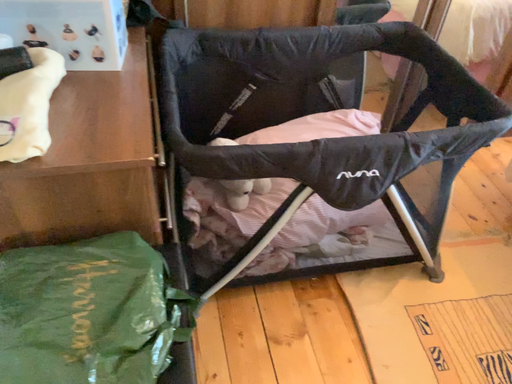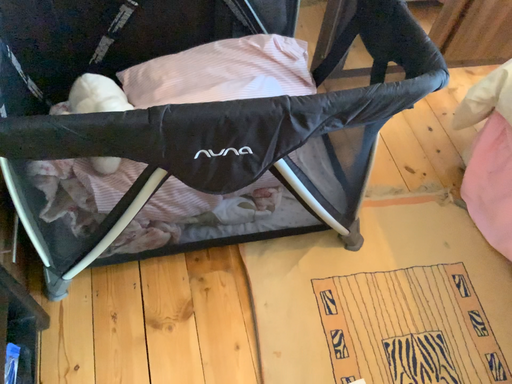
Question: How did the camera likely rotate when shooting the video?

Choices:
 (A) rotated upward
 (B) rotated downward

Answer: (B)